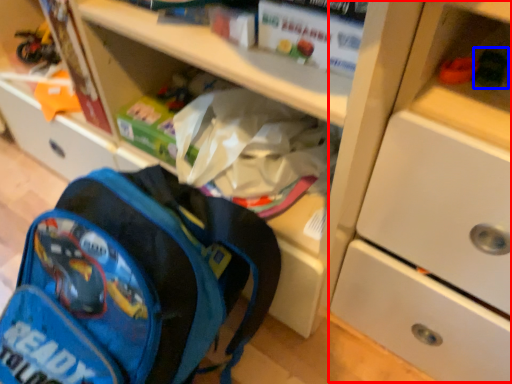
Question: Among these objects, which one is farthest to the camera, cabinetry (highlighted by a red box) or toy (highlighted by a blue box)?

Choices:
 (A) cabinetry
 (B) toy

Answer: (B)